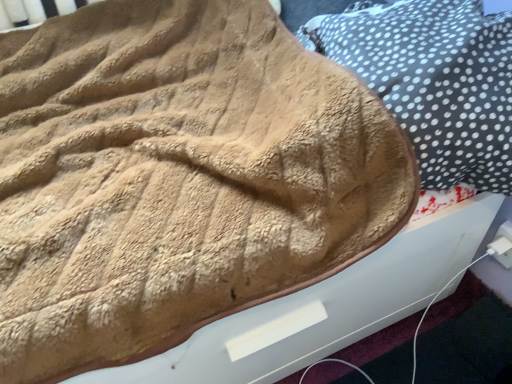
This screenshot has width=512, height=384. What do you see at coordinates (502, 245) in the screenshot? I see `white plastic plug at lower right` at bounding box center [502, 245].

What is the approximate height of white plastic plug at lower right?

4.61 inches.

Image resolution: width=512 pixels, height=384 pixels. What are the coordinates of `white plastic plug at lower right` in the screenshot? It's located at (502, 245).

This screenshot has height=384, width=512. What are the coordinates of `beige fuzzy pillow at upper right` in the screenshot? It's located at (433, 81).

The image size is (512, 384). Describe the element at coordinates (433, 81) in the screenshot. I see `beige fuzzy pillow at upper right` at that location.

At what (x,y) coordinates should I click in order to perform the action: click on white plastic plug at lower right. Please return your answer as a coordinate pair (x, y). Image resolution: width=512 pixels, height=384 pixels. Looking at the image, I should click on (502, 245).

Which object is positioned more to the right, beige fuzzy pillow at upper right or white plastic plug at lower right?

From the viewer's perspective, white plastic plug at lower right appears more on the right side.

Consider the image. Which object is closer to the camera, beige fuzzy pillow at upper right or white plastic plug at lower right?

beige fuzzy pillow at upper right is closer to the camera.

Which point is more forward, (412, 53) or (494, 238)?

The point (412, 53) is closer to the camera.

From the image's perspective, is beige fuzzy pillow at upper right located above white plastic plug at lower right?

Yes, from the image's perspective, beige fuzzy pillow at upper right is on top of white plastic plug at lower right.

From a real-world perspective, is beige fuzzy pillow at upper right located higher than white plastic plug at lower right?

Correct, in the physical world, beige fuzzy pillow at upper right is higher than white plastic plug at lower right.

Does beige fuzzy pillow at upper right have a lesser width compared to white plastic plug at lower right?

No.

Does beige fuzzy pillow at upper right have a greater height compared to white plastic plug at lower right?

Indeed, beige fuzzy pillow at upper right has a greater height compared to white plastic plug at lower right.

In the scene shown: Considering the sizes of beige fuzzy pillow at upper right and white plastic plug at lower right in the image, is beige fuzzy pillow at upper right bigger or smaller than white plastic plug at lower right?

A: beige fuzzy pillow at upper right is bigger than white plastic plug at lower right.

Choose the correct answer: Is beige fuzzy pillow at upper right inside white plastic plug at lower right or outside it?

beige fuzzy pillow at upper right exists outside the volume of white plastic plug at lower right.

Would you say beige fuzzy pillow at upper right is a long distance from white plastic plug at lower right?

No, beige fuzzy pillow at upper right is not far from white plastic plug at lower right.

Is beige fuzzy pillow at upper right facing towards white plastic plug at lower right?

No, beige fuzzy pillow at upper right is not facing towards white plastic plug at lower right.

From the picture: What's the angular difference between beige fuzzy pillow at upper right and white plastic plug at lower right's facing directions?

2.92 degrees.

How distant is beige fuzzy pillow at upper right from white plastic plug at lower right?

beige fuzzy pillow at upper right and white plastic plug at lower right are 17.73 inches apart from each other.

Locate an element on the screen. This screenshot has height=384, width=512. pillow on the left side of white plastic plug at lower right is located at coordinates (433, 81).

Considering the relative positions of white plastic plug at lower right and beige fuzzy pillow at upper right in the image provided, is white plastic plug at lower right to the left of beige fuzzy pillow at upper right from the viewer's perspective?

No, white plastic plug at lower right is not to the left of beige fuzzy pillow at upper right.

Is white plastic plug at lower right positioned behind beige fuzzy pillow at upper right?

Yes, the depth of white plastic plug at lower right is greater than that of beige fuzzy pillow at upper right.

Is point (500, 244) closer or farther from the camera than point (450, 49)?

Point (500, 244).

From the image's perspective, who appears lower, white plastic plug at lower right or beige fuzzy pillow at upper right?

white plastic plug at lower right is shown below in the image.

From a real-world perspective, which is physically above, white plastic plug at lower right or beige fuzzy pillow at upper right?

beige fuzzy pillow at upper right is physically above.

Is white plastic plug at lower right wider than beige fuzzy pillow at upper right?

No.

Based on the photo, does white plastic plug at lower right have a lesser height compared to beige fuzzy pillow at upper right?

Yes.

Which of these two, white plastic plug at lower right or beige fuzzy pillow at upper right, is bigger?

With larger size is beige fuzzy pillow at upper right.

Can beige fuzzy pillow at upper right be found inside white plastic plug at lower right?

That's incorrect, beige fuzzy pillow at upper right is not inside white plastic plug at lower right.

Would you say white plastic plug at lower right is a long distance from beige fuzzy pillow at upper right?

Actually, white plastic plug at lower right and beige fuzzy pillow at upper right are a little close together.

Could you tell me if white plastic plug at lower right is turned towards beige fuzzy pillow at upper right?

No, white plastic plug at lower right is not facing towards beige fuzzy pillow at upper right.

What's the angular difference between white plastic plug at lower right and beige fuzzy pillow at upper right's facing directions?

2.92 degrees separate the facing orientations of white plastic plug at lower right and beige fuzzy pillow at upper right.

The image size is (512, 384). In order to click on electric outlet behind the beige fuzzy pillow at upper right in this screenshot , I will do [502, 245].

The image size is (512, 384). Find the location of `pillow above the white plastic plug at lower right (from the image's perspective)`. pillow above the white plastic plug at lower right (from the image's perspective) is located at coordinates (433, 81).

Identify the location of electric outlet beneath the beige fuzzy pillow at upper right (from a real-world perspective). This screenshot has height=384, width=512. (502, 245).